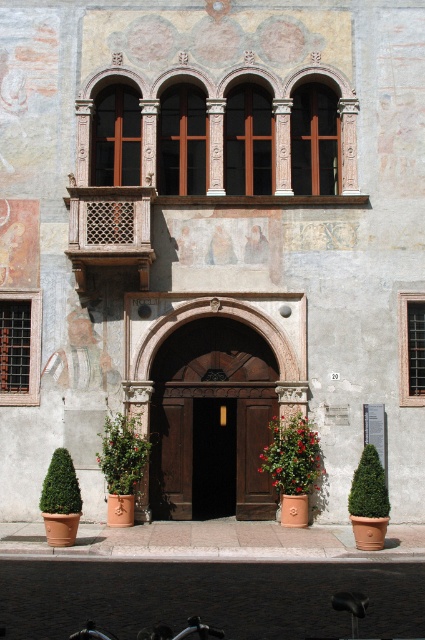
In the scene shown: You are a gardener who needs to water the plants. You have a watering can that can hold enough water for one large plant or two small plants. Looking at the green leafy plant at lower center and the green leafy bush at lower left, which one requires more water?

The green leafy plant at lower center requires more water because it has a larger size compared to the green leafy bush at lower left.

You are a gardener who needs to replace the pots of the plants at the historic building entrance. The red matte flower pot at lower center and the green leafy bush at lower left are both in need of new containers. Considering their current sizes, which plant requires a larger pot?

The red matte flower pot at lower center requires a larger pot because it is currently larger in size than the green leafy bush at lower left.